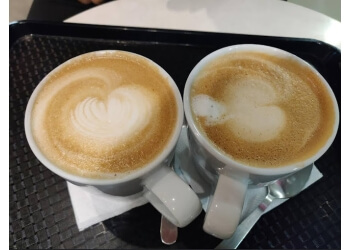
Point to any where you hold the mugs in the image. Your answer should be formatted as a list of tuples, i.e. [(x1, y1), (x2, y2), ...], where each tuple contains the x and y coordinates of a point satisfying the conditions above.

[(230, 203), (173, 187)]